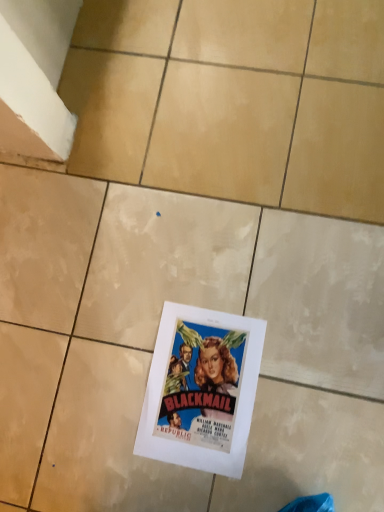
Where is `spots to the right of matte paper poster at center`? The height and width of the screenshot is (512, 384). spots to the right of matte paper poster at center is located at coordinates (307, 338).